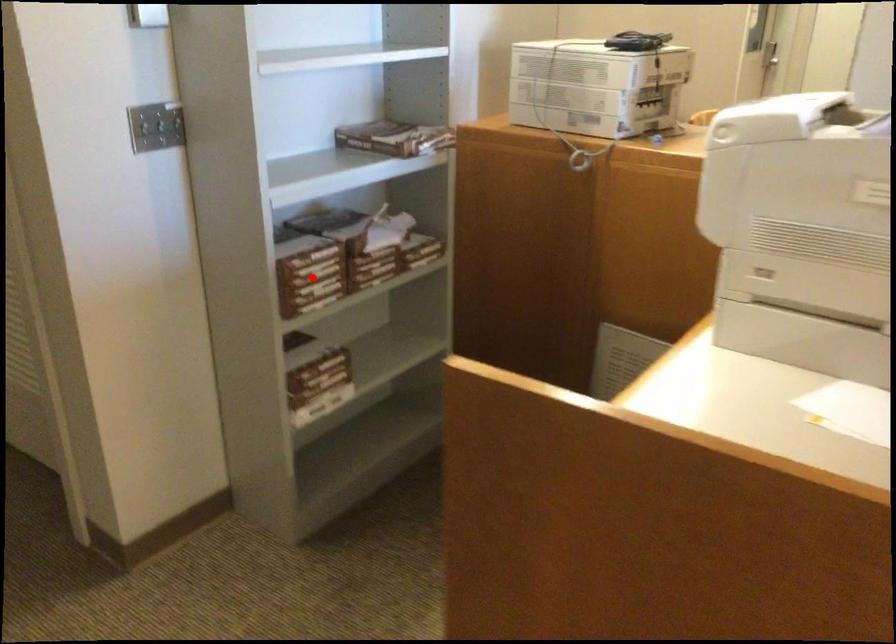
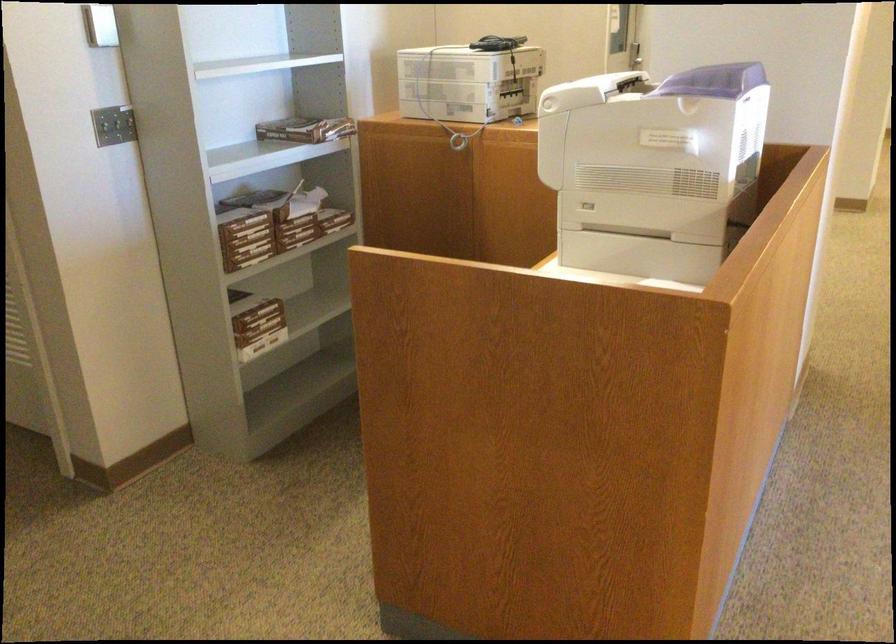
Question: I am providing you with two images of the same scene from different viewpoints. Given a red point in image1, look at the same physical point in image2. Is it:

Choices:
 (A) Closer to the viewpoint
 (B) Farther from the viewpoint

Answer: (B)